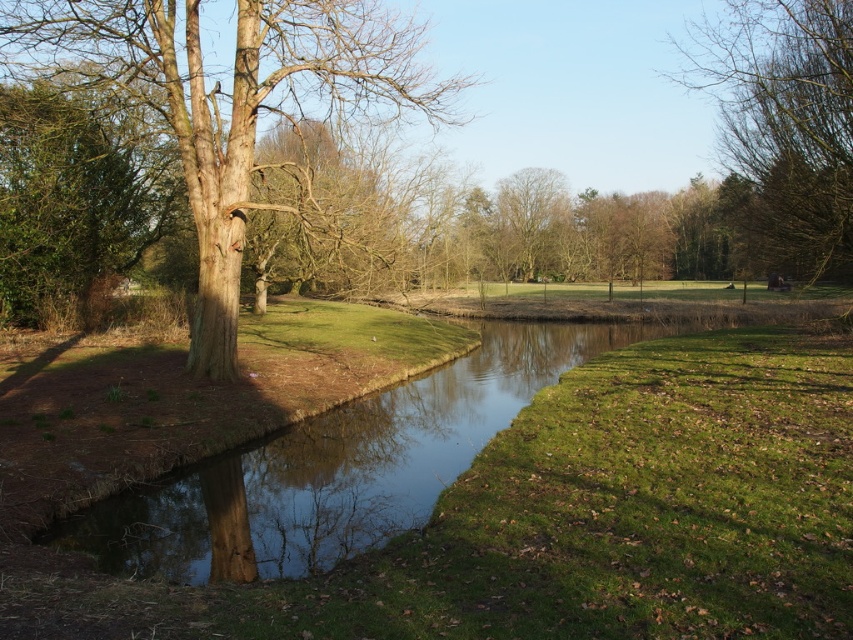
Question: Can you confirm if bare wood tree at upper right is positioned to the right of bare brown tree at center?

Choices:
 (A) no
 (B) yes

Answer: (B)

Question: Which point is closer to the camera taking this photo?

Choices:
 (A) (737, 214)
 (B) (65, 90)
 (C) (535, 202)
 (D) (154, 540)

Answer: (D)

Question: Which of these objects is positioned closest to the smooth brown tree trunk at left?

Choices:
 (A) bare wood tree at upper right
 (B) clear water at center

Answer: (B)

Question: Which object appears farthest from the camera in this image?

Choices:
 (A) bare brown tree at center
 (B) green leafy tree at left

Answer: (A)

Question: Is clear water at center to the left of bare wood tree at upper right from the viewer's perspective?

Choices:
 (A) no
 (B) yes

Answer: (B)

Question: Is smooth brown tree trunk at left positioned before bare wood tree at upper right?

Choices:
 (A) yes
 (B) no

Answer: (A)